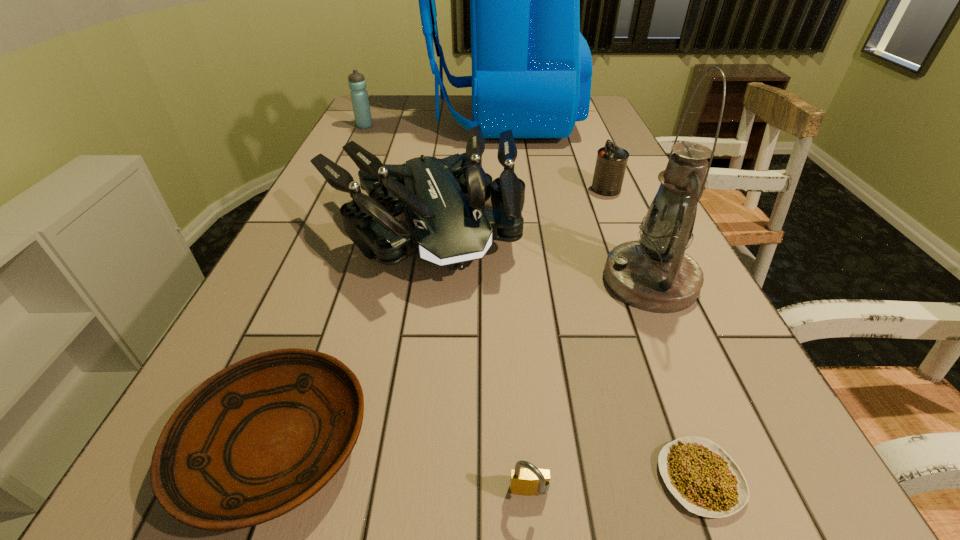
The image size is (960, 540). Find the location of `backpack`. backpack is located at coordinates (531, 67).

Image resolution: width=960 pixels, height=540 pixels. I want to click on oil lamp, so click(x=654, y=274).

Image resolution: width=960 pixels, height=540 pixels. In order to click on water bottle in this screenshot , I will do `click(359, 96)`.

Find the location of a particular element. The width and height of the screenshot is (960, 540). drone is located at coordinates (446, 223).

I want to click on the fifth tallest object, so click(x=611, y=162).

Locate an element on the screen. the sixth tallest object is located at coordinates (529, 481).

At what (x,y) coordinates should I click in order to perform the action: click on legume. Please return your answer as a coordinate pair (x, y). The width and height of the screenshot is (960, 540). Looking at the image, I should click on (699, 473).

Locate an element on the screen. vacant area located 0.270m on the back of the tallest object is located at coordinates (350, 121).

This screenshot has height=540, width=960. Find the location of `free spot located 0.100m on the back of the tallest object`. free spot located 0.100m on the back of the tallest object is located at coordinates (399, 121).

Identify the location of free space located 0.190m on the back of the tallest object. The height and width of the screenshot is (540, 960). (373, 121).